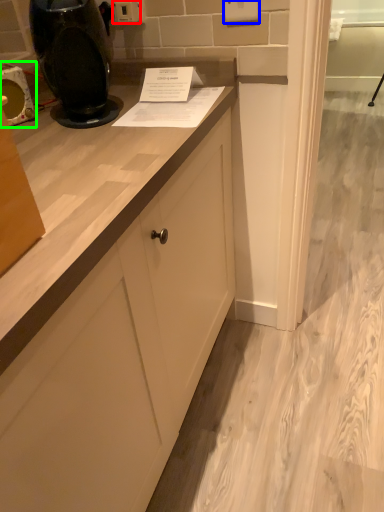
Question: Considering the real-world distances, which object is farthest from electric outlet (highlighted by a red box)? electric outlet (highlighted by a blue box) or appliance (highlighted by a green box)?

Choices:
 (A) electric outlet
 (B) appliance

Answer: (B)